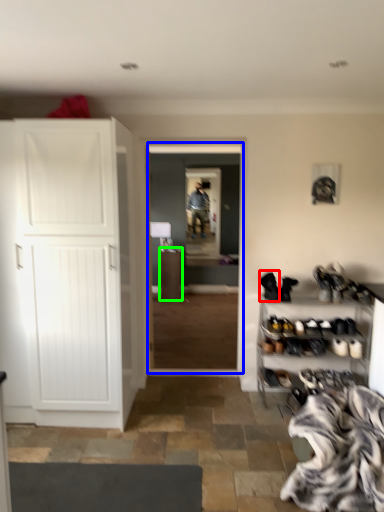
Question: Which is farther away from footwear (highlighted by a red box)? corridor (highlighted by a blue box) or cabinetry (highlighted by a green box)?

Choices:
 (A) corridor
 (B) cabinetry

Answer: (A)